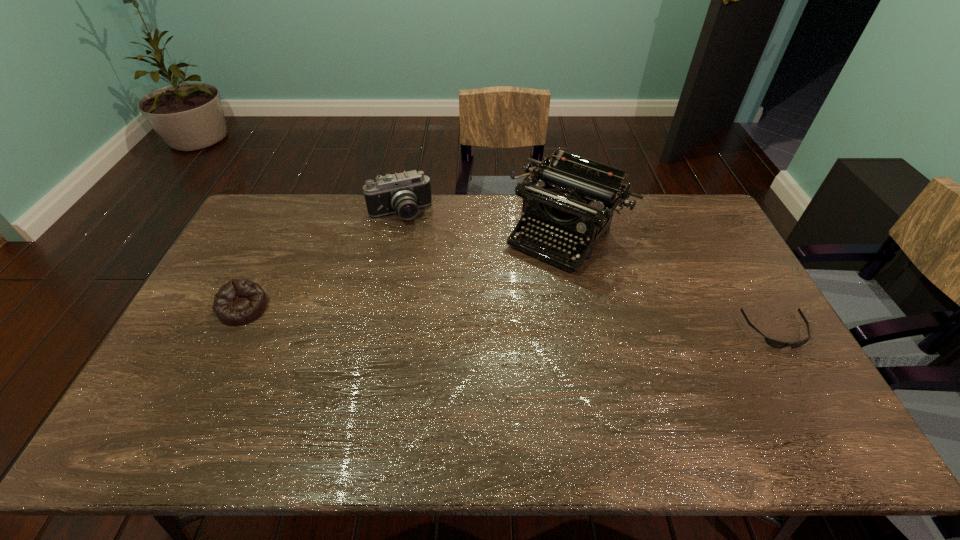
Locate an element on the screen. free space at the far edge of the desktop is located at coordinates (624, 230).

This screenshot has width=960, height=540. In order to click on free region at the near edge in this screenshot , I will do `click(431, 403)`.

Image resolution: width=960 pixels, height=540 pixels. In order to click on vacant position at the left edge of the desktop in this screenshot , I will do `click(215, 341)`.

You are a GUI agent. You are given a task and a screenshot of the screen. Output one action in this format:
    pyautogui.click(x=<x>, y=<y>)
    Task: Click on the free spot at the right edge of the desktop
    
    Given the screenshot: What is the action you would take?
    pyautogui.click(x=714, y=288)

Identify the location of vacant area at the far left corner of the desktop. The image size is (960, 540). (280, 204).

This screenshot has width=960, height=540. I want to click on empty space that is in between the beanbag and the third object from left to right, so click(405, 271).

Where is `free space between the sunglasses and the second tallest object`? The height and width of the screenshot is (540, 960). free space between the sunglasses and the second tallest object is located at coordinates (588, 272).

Locate an element on the screen. The height and width of the screenshot is (540, 960). free spot between the leftmost object and the second object from left to right is located at coordinates (322, 261).

Identify the location of free space between the sunglasses and the third shortest object. click(x=588, y=272).

Where is `free space between the third object from right to left and the tallest object`? The image size is (960, 540). free space between the third object from right to left and the tallest object is located at coordinates (484, 224).